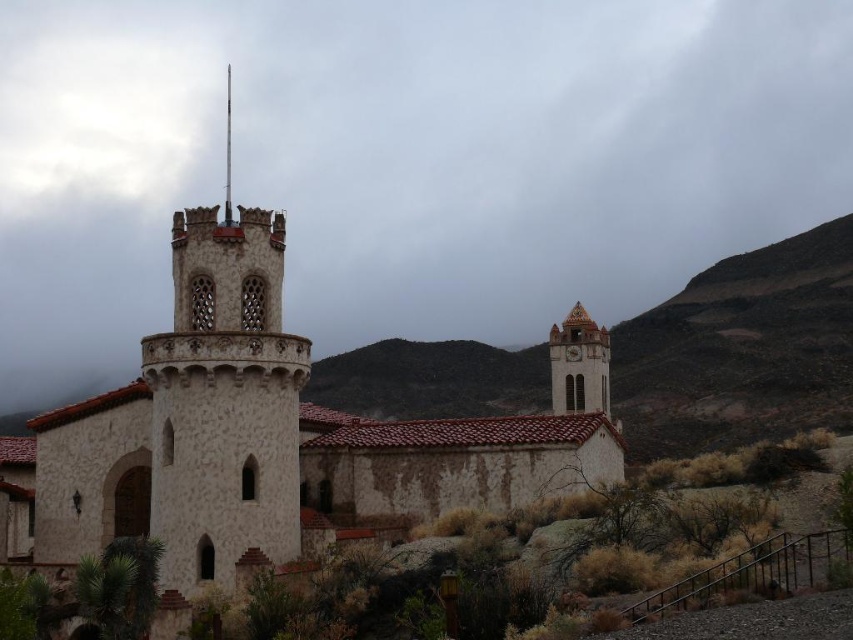
You are standing at the point marked by the coordinate point at point (257,440). Looking towards the historic building with the round tower on the left and the rectangular tower on the right, which direction should you face to have the round tower on your left and the rectangular tower on your right?

Since the white stone church at center is represented by point (257,440), you should face north to have the round tower on your left and the rectangular tower on your right.

You are standing in front of the historic building and want to take a photo of both the white stone church at center and the smooth stone spire at upper center. Which object should you focus on first to ensure both are in the frame?

You should focus on the white stone church at center first because it is closer to the viewer than the smooth stone spire at upper center, so adjusting the focus to the closer object will help keep both in the frame.

You are a drone operator tasked with capturing aerial footage of the historic building. Your drone has a maximum flight range of 70 meters. You need to fly from the smooth stone spire at upper center to the white stone clock at upper right. Can your drone complete this flight without needing to return to its starting point?

The smooth stone spire at upper center and white stone clock at upper right are 72.34 meters apart from each other. Since the drone has a maximum flight range of 70 meters, it cannot complete the flight between them without needing to return to its starting point.